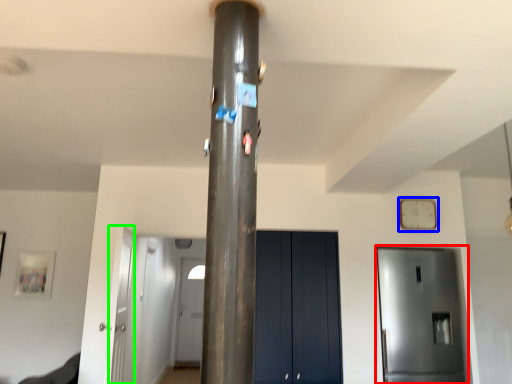
Question: Which is farther away from door (highlighted by a red box)? clock (highlighted by a blue box) or door (highlighted by a green box)?

Choices:
 (A) clock
 (B) door

Answer: (B)